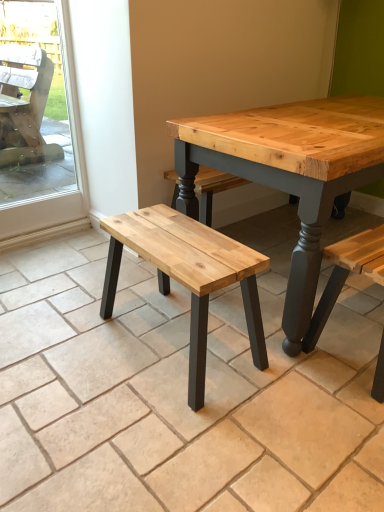
This screenshot has height=512, width=384. In order to click on vacant space to the left of natural wood bench at center in this screenshot , I will do `click(69, 343)`.